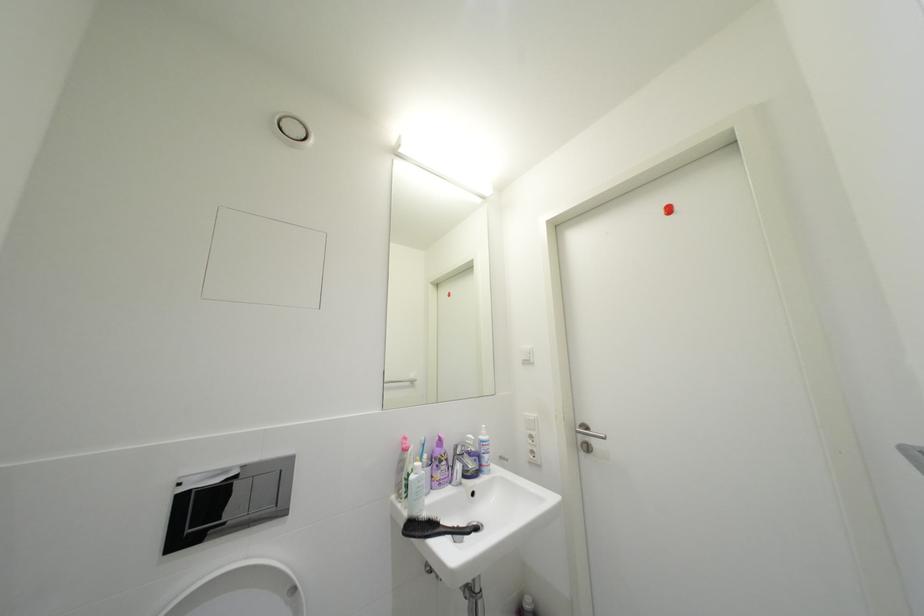
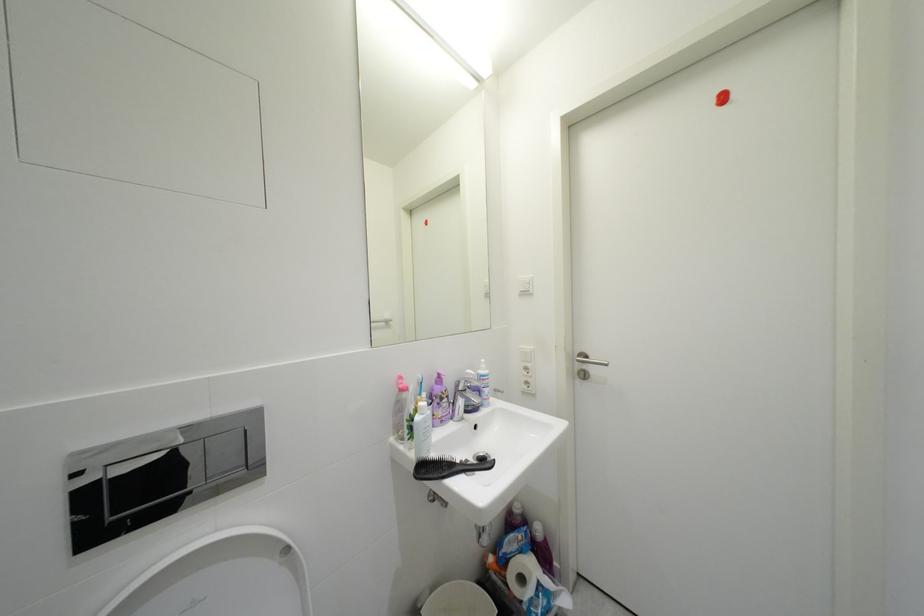
In a continuous first-person perspective shot, in which direction is the camera moving?

The cameraman walked toward left, forward.